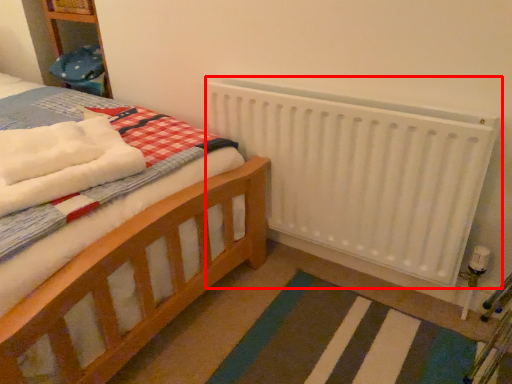
Question: From the image's perspective, where is radiator (annotated by the red box) located in relation to bath towel in the image?

Choices:
 (A) below
 (B) above

Answer: (A)